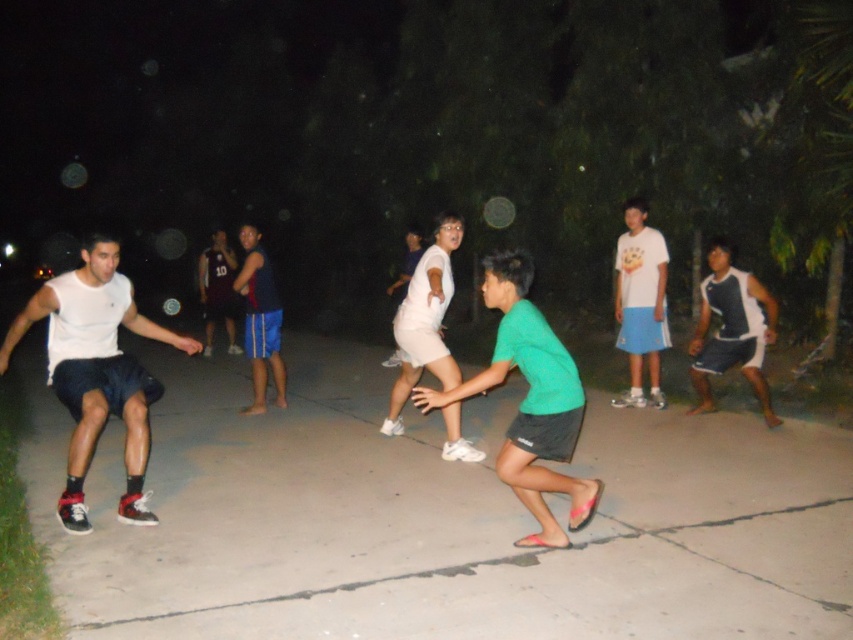
Is point (67, 515) less distant than point (230, 342)?

Yes, it is.

Is white matte shorts at left smaller than dark purple jersey at center?

No.

Which is behind, point (64, 320) or point (231, 273)?

Point (231, 273)

Locate an element on the screen. This screenshot has height=640, width=853. white matte shorts at left is located at coordinates (96, 371).

Is green matte shirt at center below dark blue jersey at center?

Indeed, green matte shirt at center is positioned under dark blue jersey at center.

Who is shorter, green matte shirt at center or dark blue jersey at center?

green matte shirt at center

Which is in front, point (523, 481) or point (247, 259)?

Point (523, 481)

Identify the location of green matte shirt at center. (529, 401).

Does point (173, 432) come closer to viewer compared to point (96, 432)?

No.

Which is in front, point (151, 538) or point (48, 348)?

Point (151, 538) is more forward.

Who is more forward, [55,472] or [86,392]?

Point [86,392]

Find the location of `gray concrete pavement at center`. gray concrete pavement at center is located at coordinates (437, 518).